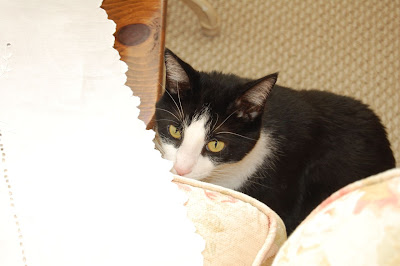
The image size is (400, 266). In order to click on table leg in this screenshot , I will do `click(203, 9)`.